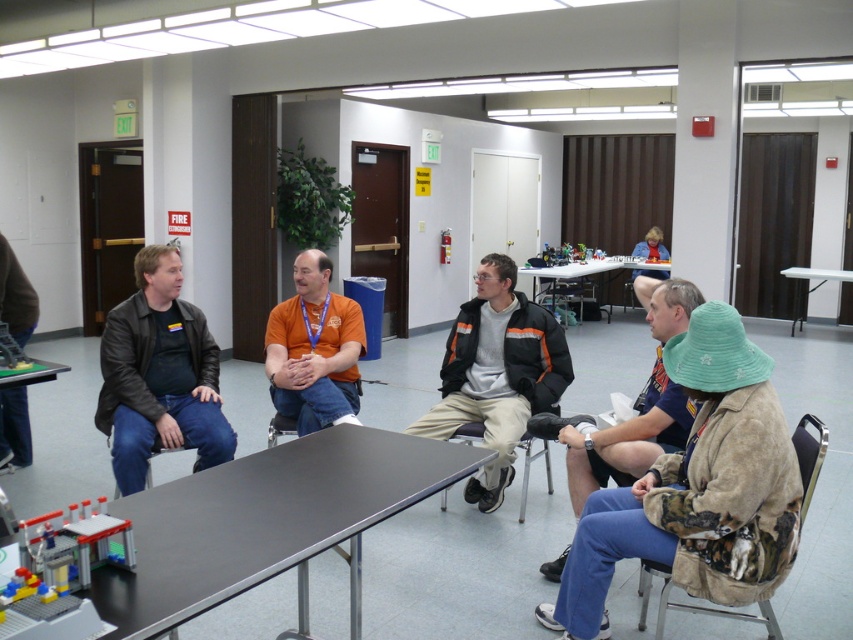
You are sitting at the green plastic table at lower left and want to hand a document to the person wearing the leather jacket at left. Since the table is between you and them, can you still reach them directly without moving around the table?

The leather jacket at left is in front of the green plastic table at lower left, meaning the person is positioned between you and the table. Therefore, you can reach them directly without needing to move around the table.

You are standing at the entrance of the conference room and want to place a large plant pot on the floor. The plant pot requires a space of at least 1 meter in diameter. Based on the coordinates of the black metal table at lower left, is there enough space to place the plant pot near it?

The black metal table at lower left is located at coordinates point (265, 524). Since the plant pot requires a space of at least 1 meter in diameter, and the table is at a specific coordinate point, there is insufficient information to determine the available space around the table. More details about the room dimensions or the table size are needed to confirm if the plant pot can be placed nearby.